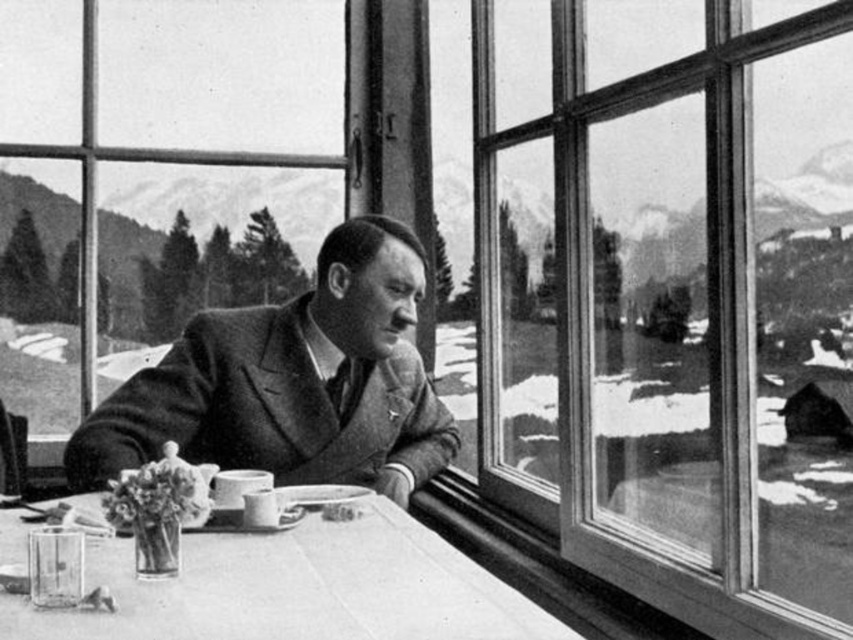
Question: Which of the following is the farthest from the observer?

Choices:
 (A) (346, 580)
 (B) (236, 336)

Answer: (B)

Question: Can you confirm if smooth woolen suit at center is positioned below smooth wooden table at center?

Choices:
 (A) yes
 (B) no

Answer: (B)

Question: Does smooth woolen suit at center lie in front of smooth wooden table at center?

Choices:
 (A) yes
 (B) no

Answer: (B)

Question: Which of the following is the closest to the observer?

Choices:
 (A) smooth wooden table at center
 (B) smooth woolen suit at center

Answer: (A)

Question: Is smooth woolen suit at center wider than smooth wooden table at center?

Choices:
 (A) yes
 (B) no

Answer: (B)

Question: Which object appears closest to the camera in this image?

Choices:
 (A) smooth wooden table at center
 (B) smooth woolen suit at center

Answer: (A)